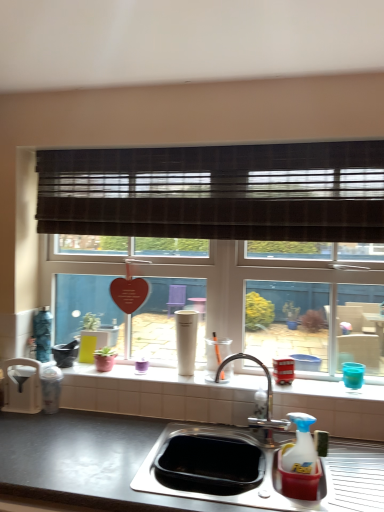
Question: Can you see brown textured blind at upper center touching white matte cup at center, the third appliance from the left?

Choices:
 (A) yes
 (B) no

Answer: (B)

Question: Is brown textured blind at upper center outside of white matte cup at center, the third appliance from the left?

Choices:
 (A) yes
 (B) no

Answer: (A)

Question: Does brown textured blind at upper center appear on the right side of white matte cup at center, the third appliance viewed from the right?

Choices:
 (A) no
 (B) yes

Answer: (B)

Question: Is white matte cup at center, the third appliance viewed from the right, at the back of brown textured blind at upper center?

Choices:
 (A) yes
 (B) no

Answer: (B)

Question: Can you confirm if brown textured blind at upper center is smaller than white matte cup at center, the third appliance from the left?

Choices:
 (A) yes
 (B) no

Answer: (B)

Question: Considering the positions of metallic silver blender at lower left, which ranks as the 4th appliance in right-to-left order, and brown textured blind at upper center in the image, is metallic silver blender at lower left, which ranks as the 4th appliance in right-to-left order, taller or shorter than brown textured blind at upper center?

Choices:
 (A) short
 (B) tall

Answer: (A)

Question: Is metallic silver blender at lower left, which ranks as the second appliance in left-to-right order, inside the boundaries of brown textured blind at upper center, or outside?

Choices:
 (A) inside
 (B) outside

Answer: (B)

Question: Looking at the image, does metallic silver blender at lower left, which ranks as the second appliance in left-to-right order, seem bigger or smaller compared to brown textured blind at upper center?

Choices:
 (A) small
 (B) big

Answer: (A)

Question: From a real-world perspective, is metallic silver blender at lower left, which ranks as the second appliance in left-to-right order, physically located above or below brown textured blind at upper center?

Choices:
 (A) above
 (B) below

Answer: (B)

Question: Is metallic red bus at right, positioned as the fourth appliance in left-to-right order, wider or thinner than white glossy window sill at center?

Choices:
 (A) wide
 (B) thin

Answer: (B)

Question: From a real-world perspective, is metallic red bus at right, positioned as the fourth appliance in left-to-right order, physically located above or below white glossy window sill at center?

Choices:
 (A) above
 (B) below

Answer: (A)

Question: From the image's perspective, relative to white glossy window sill at center, is metallic red bus at right, the 2th appliance in the right-to-left sequence, above or below?

Choices:
 (A) above
 (B) below

Answer: (A)

Question: Is point (274, 369) closer or farther from the camera than point (248, 379)?

Choices:
 (A) closer
 (B) farther

Answer: (A)

Question: Is stainless steel sink at lower center bigger or smaller than metallic red bus at right, the 2th appliance in the right-to-left sequence?

Choices:
 (A) big
 (B) small

Answer: (A)

Question: Is stainless steel sink at lower center wider or thinner than metallic red bus at right, the 2th appliance in the right-to-left sequence?

Choices:
 (A) thin
 (B) wide

Answer: (B)